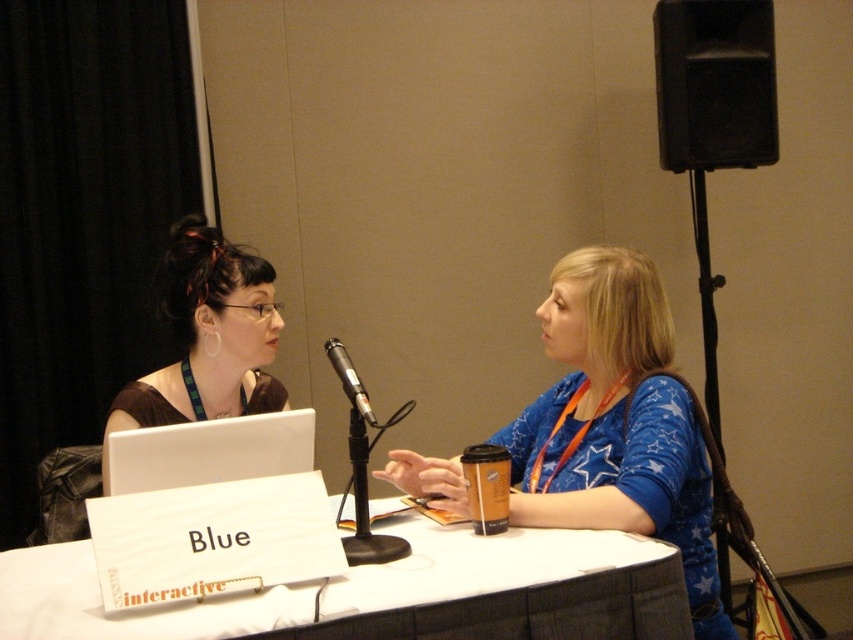
You are a participant in a discussion and need to reach the white paperboard at center to write something. You are currently standing 1.2 meters away from it. Can you comfortably reach it without moving closer?

The white paperboard at center is 1.10 meters away from the viewer. Since you are standing 1.2 meters away, you are slightly farther than the paperboard. You may need to take a small step forward to comfortably reach it.

You are a photographer trying to capture a clear photo of both the blue fabric shirt at center and the matte brown shirt at center. Since you want both shirts to be visible in the frame, which shirt should you focus on to ensure the taller one is in focus?

The blue fabric shirt at center is much taller than the matte brown shirt at center. To ensure the taller one is in focus, you should focus on the blue fabric shirt at center.